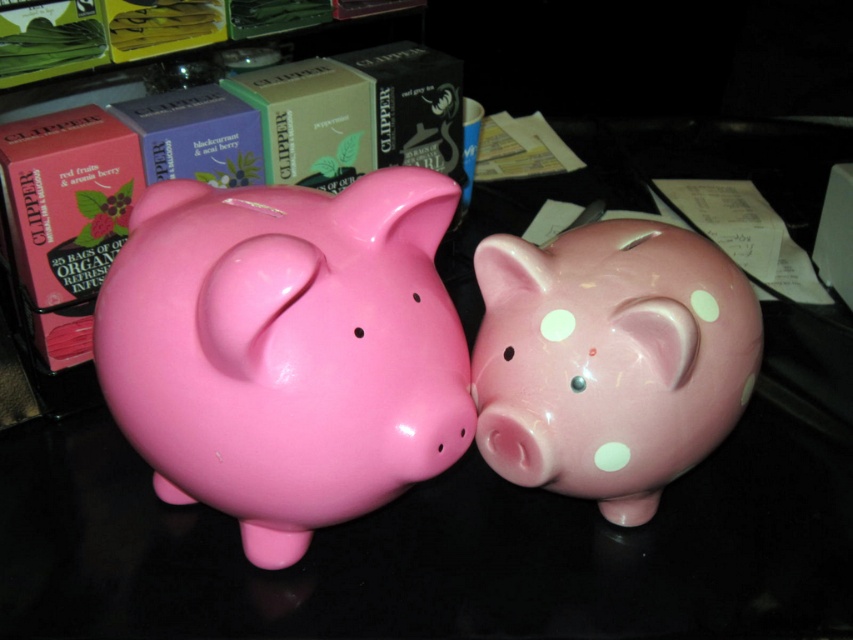
Based on the photo, between glossy ceramic piggy bank at center left and pink glossy piggy bank at center, which one has more height?

glossy ceramic piggy bank at center left is taller.

Does glossy ceramic piggy bank at center left have a smaller size compared to pink glossy piggy bank at center?

No, glossy ceramic piggy bank at center left is not smaller than pink glossy piggy bank at center.

Where is `glossy ceramic piggy bank at center left`? The height and width of the screenshot is (640, 853). glossy ceramic piggy bank at center left is located at coordinates (286, 349).